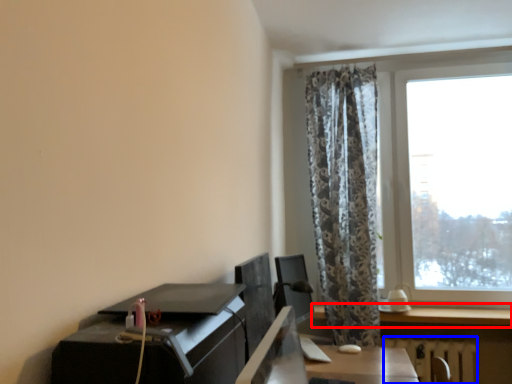
Question: Among these objects, which one is farthest to the camera, window (highlighted by a red box) or radiator (highlighted by a blue box)?

Choices:
 (A) window
 (B) radiator

Answer: (B)